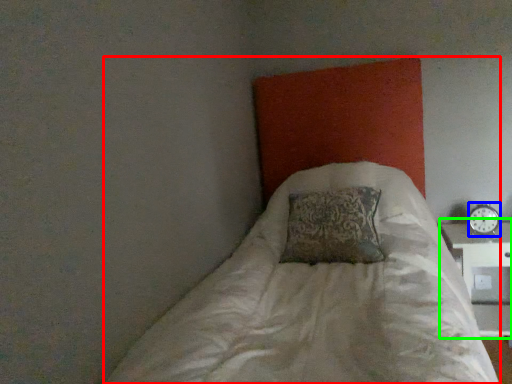
Question: Which object is the closest to the bed (highlighted by a red box)? Choose among these: clock (highlighted by a blue box) or table (highlighted by a green box).

Choices:
 (A) clock
 (B) table

Answer: (B)